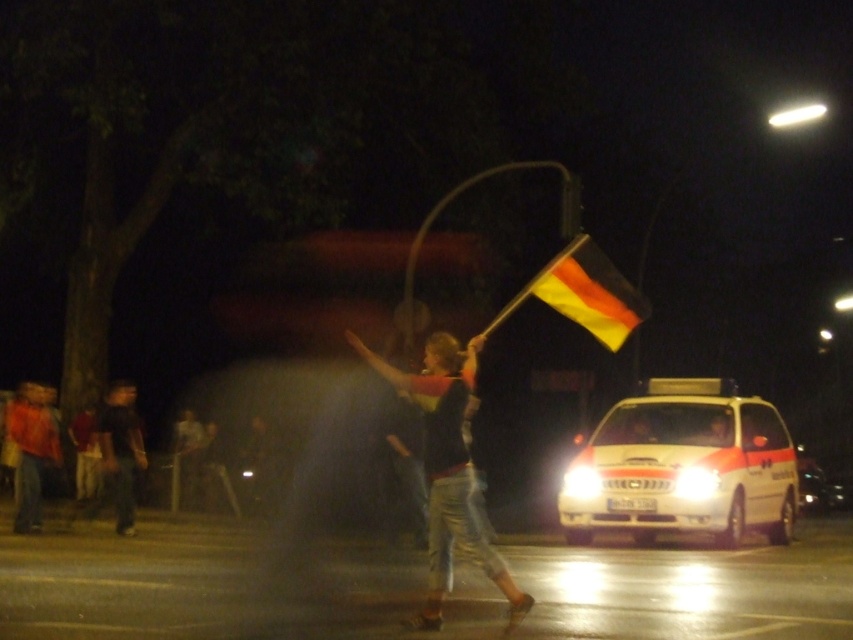
You are a photographer standing at the camera position. You want to take a closeup shot of the matte black shirt at center. Considering the distance, is it possible to capture the shirt clearly without moving closer?

The matte black shirt at center is 7.00 meters away from the camera. Since this distance is relatively far, capturing a clear closeup shot without moving closer may be challenging unless using a telephoto lens or zoom capability to compensate for the distance.